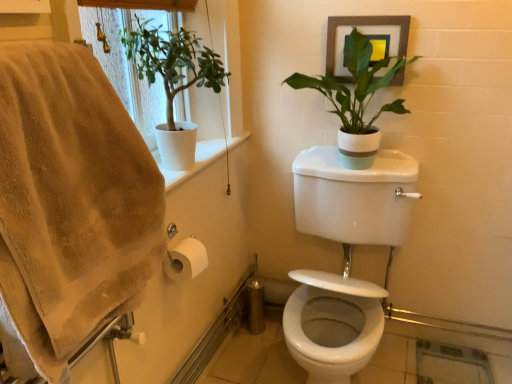
Question: Is white matte plant at upper left, positioned as the 2th houseplant in right-to-left order, next to white matte pot at upper right, which is counted as the 2th houseplant, starting from the left, and touching it?

Choices:
 (A) yes
 (B) no

Answer: (B)

Question: Does white matte plant at upper left, positioned as the 2th houseplant in right-to-left order, have a lesser width compared to white matte pot at upper right, which is counted as the first houseplant, starting from the right?

Choices:
 (A) yes
 (B) no

Answer: (B)

Question: Considering the relative positions of white matte plant at upper left, the first houseplant viewed from the left, and white matte pot at upper right, which is counted as the first houseplant, starting from the right, in the image provided, is white matte plant at upper left, the first houseplant viewed from the left, to the right of white matte pot at upper right, which is counted as the first houseplant, starting from the right, from the viewer's perspective?

Choices:
 (A) no
 (B) yes

Answer: (A)

Question: From the image's perspective, would you say white matte plant at upper left, the first houseplant viewed from the left, is shown under white matte pot at upper right, which is counted as the 2th houseplant, starting from the left?

Choices:
 (A) yes
 (B) no

Answer: (A)

Question: Would you consider white matte plant at upper left, positioned as the 2th houseplant in right-to-left order, to be distant from white matte pot at upper right, which is counted as the 2th houseplant, starting from the left?

Choices:
 (A) yes
 (B) no

Answer: (B)

Question: Is wooden framed picture at upper right in front of or behind beige cotton bath towel at left in the image?

Choices:
 (A) front
 (B) behind

Answer: (B)

Question: Is wooden framed picture at upper right situated inside beige cotton bath towel at left or outside?

Choices:
 (A) outside
 (B) inside

Answer: (A)

Question: Looking at the image, does wooden framed picture at upper right seem bigger or smaller compared to beige cotton bath towel at left?

Choices:
 (A) small
 (B) big

Answer: (A)

Question: From the image's perspective, is wooden framed picture at upper right above or below beige cotton bath towel at left?

Choices:
 (A) above
 (B) below

Answer: (A)

Question: From a real-world perspective, is white glossy toilet at center positioned above or below white matte plant at upper left, positioned as the 2th houseplant in right-to-left order?

Choices:
 (A) above
 (B) below

Answer: (B)

Question: Is white glossy toilet at center taller or shorter than white matte plant at upper left, the first houseplant viewed from the left?

Choices:
 (A) tall
 (B) short

Answer: (A)

Question: Is white glossy toilet at center wider or thinner than white matte plant at upper left, the first houseplant viewed from the left?

Choices:
 (A) thin
 (B) wide

Answer: (B)

Question: Is white glossy toilet at center to the left or to the right of white matte plant at upper left, positioned as the 2th houseplant in right-to-left order, in the image?

Choices:
 (A) left
 (B) right

Answer: (B)

Question: Is white matte plant at upper left, positioned as the 2th houseplant in right-to-left order, taller or shorter than beige cotton bath towel at left?

Choices:
 (A) short
 (B) tall

Answer: (A)

Question: Would you say white matte plant at upper left, the first houseplant viewed from the left, is to the left or to the right of beige cotton bath towel at left in the picture?

Choices:
 (A) left
 (B) right

Answer: (B)